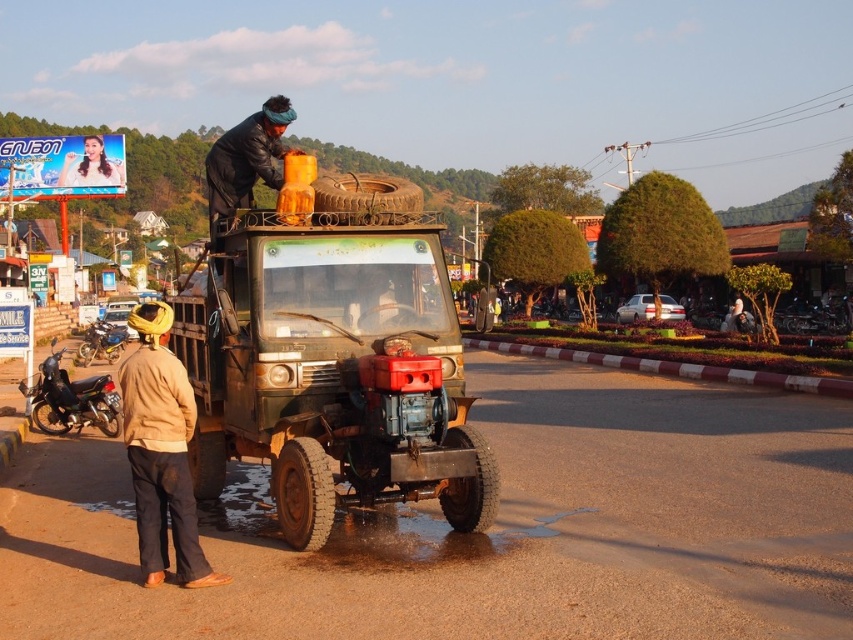
Who is higher up, black glossy motorcycle at lower left or brushed metal motorcycle at left?

brushed metal motorcycle at left is above.

Looking at this image, which is more to the right, black glossy motorcycle at lower left or brushed metal motorcycle at left?

black glossy motorcycle at lower left is more to the right.

Between point (88, 381) and point (83, 358), which one is positioned in front?

Point (88, 381) is in front.

This screenshot has height=640, width=853. I want to click on black glossy motorcycle at lower left, so pyautogui.click(x=71, y=400).

You are a GUI agent. You are given a task and a screenshot of the screen. Output one action in this format:
    pyautogui.click(x=<x>, y=<y>)
    Task: Click on the rusty metal truck at center
    This screenshot has height=640, width=853.
    Given the screenshot: What is the action you would take?
    pyautogui.click(x=331, y=369)

Can you confirm if rusty metal truck at center is positioned to the right of black glossy motorcycle at lower left?

Yes, rusty metal truck at center is to the right of black glossy motorcycle at lower left.

Which is behind, point (380, 392) or point (57, 404)?

The point (57, 404) is behind.

At what (x,y) coordinates should I click in order to perform the action: click on rusty metal truck at center. Please return your answer as a coordinate pair (x, y). This screenshot has height=640, width=853. Looking at the image, I should click on (331, 369).

Who is positioned more to the left, brown cotton jacket at lower left or black glossy motorcycle at lower left?

From the viewer's perspective, brown cotton jacket at lower left appears more on the left side.

Looking at this image, which is above, brown cotton jacket at lower left or black glossy motorcycle at lower left?

brown cotton jacket at lower left

Which is in front, point (173, 451) or point (61, 433)?

Point (173, 451) is more forward.

Identify the location of brown cotton jacket at lower left. The height and width of the screenshot is (640, 853). (161, 451).